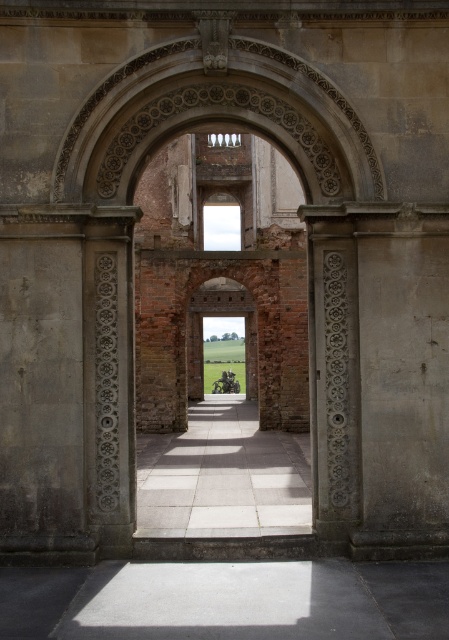
Question: Which of the following is the closest to the observer?

Choices:
 (A) (422, 419)
 (B) (238, 394)

Answer: (A)

Question: Considering the relative positions of smooth stone pillar at center and white stone path at center in the image provided, where is smooth stone pillar at center located with respect to white stone path at center?

Choices:
 (A) right
 (B) left

Answer: (A)

Question: From the image, what is the correct spatial relationship of smooth stone pillar at center in relation to white stone path at center?

Choices:
 (A) below
 (B) above

Answer: (B)

Question: Which object is closer to the camera taking this photo?

Choices:
 (A) smooth stone pillar at center
 (B) white stone path at center

Answer: (A)

Question: Does smooth stone pillar at center appear on the right side of white stone path at center?

Choices:
 (A) no
 (B) yes

Answer: (B)